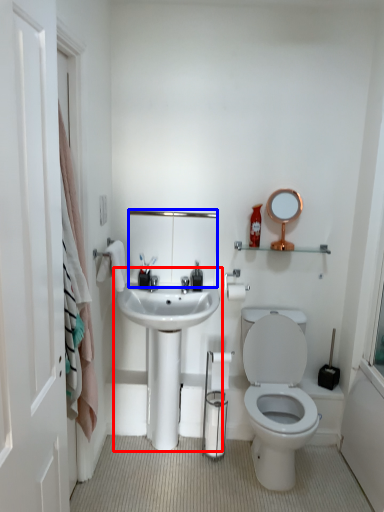
Question: Which of the following is the closest to the observer, sink (highlighted by a red box) or mirror (highlighted by a blue box)?

Choices:
 (A) sink
 (B) mirror

Answer: (A)